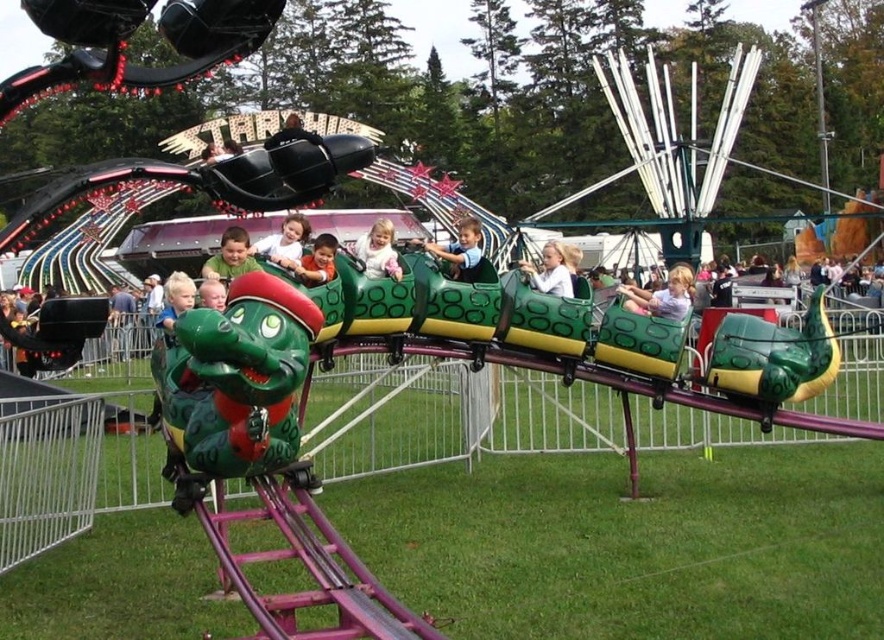
Is light brown fabric shirt at center thinner than matte green dragon at center?

No.

What do you see at coordinates (663, 296) in the screenshot? I see `light brown fabric shirt at center` at bounding box center [663, 296].

Where is `light brown fabric shirt at center`? light brown fabric shirt at center is located at coordinates (663, 296).

The image size is (884, 640). In order to click on light brown fabric shirt at center in this screenshot , I will do `click(663, 296)`.

Does white matte dress at center have a greater width compared to green matte dragon at center?

In fact, white matte dress at center might be narrower than green matte dragon at center.

Where is `white matte dress at center`? The image size is (884, 640). white matte dress at center is located at coordinates (378, 252).

Where is `white matte dress at center`? white matte dress at center is located at coordinates (378, 252).

Which of these two, light brown fabric shirt at center or white matte dress at center, stands shorter?

With less height is light brown fabric shirt at center.

Does point (673, 266) lie behind point (398, 273)?

Yes, point (673, 266) is behind point (398, 273).

Measure the distance between light brown fabric shirt at center and camera.

light brown fabric shirt at center is 26.77 meters away from camera.

You are a GUI agent. You are given a task and a screenshot of the screen. Output one action in this format:
    pyautogui.click(x=<x>, y=<y>)
    Task: Click on the light brown fabric shirt at center
    
    Given the screenshot: What is the action you would take?
    pyautogui.click(x=663, y=296)